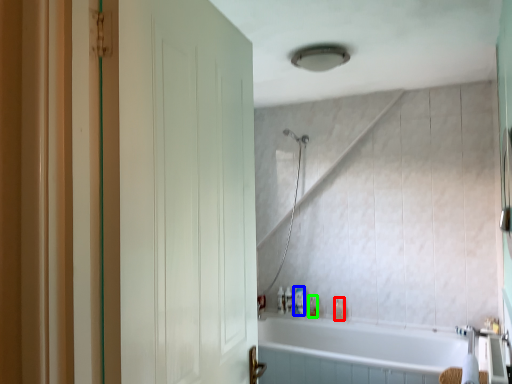
Question: Estimate the real-world distances between objects in this image. Which object is farther from toiletry (highlighted by a red box), toiletry (highlighted by a blue box) or toiletry (highlighted by a green box)?

Choices:
 (A) toiletry
 (B) toiletry

Answer: (A)